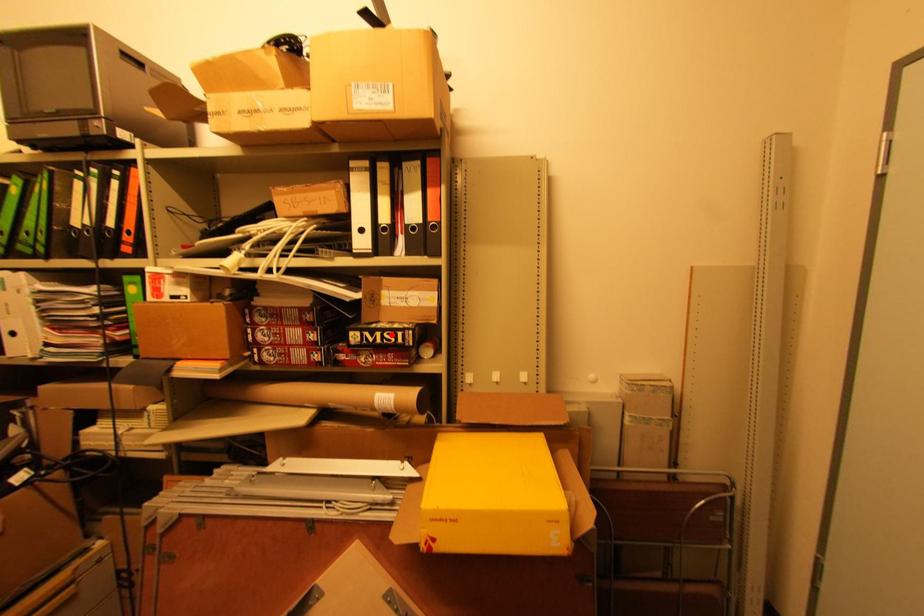
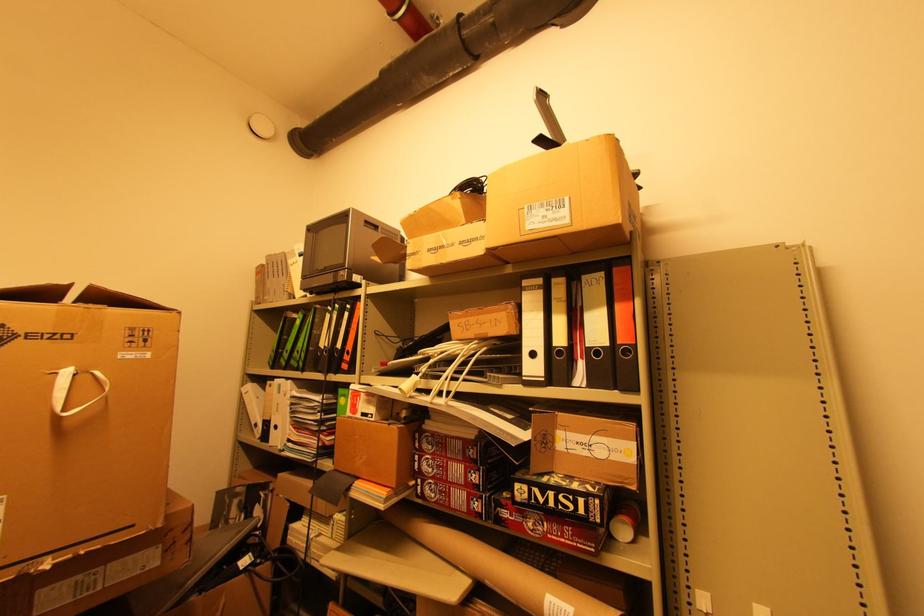
Locate, in the second image, the point that corresponds to the highlighted location in the first image.

(568, 498)